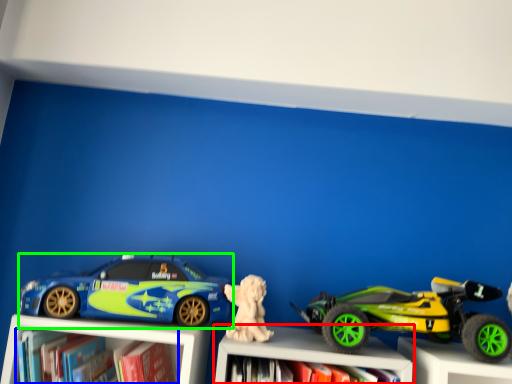
Question: Estimate the real-world distances between objects in this image. Which object is farther from bookcase (highlighted by a red box), book (highlighted by a blue box) or car (highlighted by a green box)?

Choices:
 (A) book
 (B) car

Answer: (A)